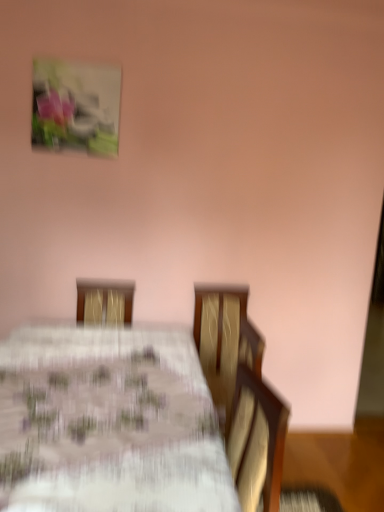
The height and width of the screenshot is (512, 384). What do you see at coordinates (76, 106) in the screenshot?
I see `matte plastic picture frame at upper left` at bounding box center [76, 106].

The image size is (384, 512). I want to click on matte plastic picture frame at upper left, so click(76, 106).

What is the approximate height of matte plastic picture frame at upper left?

20.04 inches.

Find the location of a particular element. Image resolution: width=384 pixels, height=512 pixels. white floral tablecloth at center is located at coordinates (108, 423).

This screenshot has width=384, height=512. Describe the element at coordinates (108, 423) in the screenshot. I see `white floral tablecloth at center` at that location.

You are a GUI agent. You are given a task and a screenshot of the screen. Output one action in this format:
    pyautogui.click(x=<x>, y=<y>)
    Task: Click on the matte plastic picture frame at upper left
    
    Given the screenshot: What is the action you would take?
    pyautogui.click(x=76, y=106)

Considering the relative positions of white floral tablecloth at center and matte plastic picture frame at upper left in the image provided, is white floral tablecloth at center to the left of matte plastic picture frame at upper left from the viewer's perspective?

No, white floral tablecloth at center is not to the left of matte plastic picture frame at upper left.

Does white floral tablecloth at center lie in front of matte plastic picture frame at upper left?

That is True.

Looking at this image, which is further, (x=63, y=374) or (x=119, y=85)?

Positioned behind is point (x=119, y=85).

Looking at this image, from the image's perspective, is white floral tablecloth at center under matte plastic picture frame at upper left?

Correct, white floral tablecloth at center appears lower than matte plastic picture frame at upper left in the image.

From a real-world perspective, who is located lower, white floral tablecloth at center or matte plastic picture frame at upper left?

white floral tablecloth at center.

Is white floral tablecloth at center thinner than matte plastic picture frame at upper left?

No, white floral tablecloth at center is not thinner than matte plastic picture frame at upper left.

Can you confirm if white floral tablecloth at center is taller than matte plastic picture frame at upper left?

Indeed, white floral tablecloth at center has a greater height compared to matte plastic picture frame at upper left.

Considering the sizes of white floral tablecloth at center and matte plastic picture frame at upper left in the image, is white floral tablecloth at center bigger or smaller than matte plastic picture frame at upper left?

In the image, white floral tablecloth at center appears to be larger than matte plastic picture frame at upper left.

Is white floral tablecloth at center inside or outside of matte plastic picture frame at upper left?

white floral tablecloth at center is not enclosed by matte plastic picture frame at upper left.

Is white floral tablecloth at center in contact with matte plastic picture frame at upper left?

white floral tablecloth at center and matte plastic picture frame at upper left are clearly separated.

Is white floral tablecloth at center oriented away from matte plastic picture frame at upper left?

No, white floral tablecloth at center is not facing away from matte plastic picture frame at upper left.

Can you tell me how much white floral tablecloth at center and matte plastic picture frame at upper left differ in facing direction?

The angular difference between white floral tablecloth at center and matte plastic picture frame at upper left is 1.1 degrees.

Where is `picture frame that is above the white floral tablecloth at center (from a real-world perspective)`? The image size is (384, 512). picture frame that is above the white floral tablecloth at center (from a real-world perspective) is located at coordinates (76, 106).

Considering the positions of objects matte plastic picture frame at upper left and white floral tablecloth at center in the image provided, who is more to the left, matte plastic picture frame at upper left or white floral tablecloth at center?

matte plastic picture frame at upper left.

Which object is closer to the camera, matte plastic picture frame at upper left or white floral tablecloth at center?

Positioned in front is white floral tablecloth at center.

Which point is more distant from viewer, (101, 144) or (49, 441)?

The point (101, 144) is farther.

From the image's perspective, is matte plastic picture frame at upper left on top of white floral tablecloth at center?

Yes, from the image's perspective, matte plastic picture frame at upper left is on top of white floral tablecloth at center.

From a real-world perspective, is matte plastic picture frame at upper left positioned under white floral tablecloth at center based on gravity?

No, from a real-world perspective, matte plastic picture frame at upper left is not beneath white floral tablecloth at center.

Is matte plastic picture frame at upper left wider than white floral tablecloth at center?

In fact, matte plastic picture frame at upper left might be narrower than white floral tablecloth at center.

Which of these two, matte plastic picture frame at upper left or white floral tablecloth at center, stands taller?

white floral tablecloth at center is taller.

Can you confirm if matte plastic picture frame at upper left is smaller than white floral tablecloth at center?

Yes.

Consider the image. Is matte plastic picture frame at upper left located outside white floral tablecloth at center?

Yes, matte plastic picture frame at upper left is not within white floral tablecloth at center.

Are matte plastic picture frame at upper left and white floral tablecloth at center far apart?

Yes, matte plastic picture frame at upper left and white floral tablecloth at center are located far from each other.

Does matte plastic picture frame at upper left turn towards white floral tablecloth at center?

No, matte plastic picture frame at upper left is not oriented towards white floral tablecloth at center.

How different are the orientations of matte plastic picture frame at upper left and white floral tablecloth at center in degrees?

They differ by 1.1 degrees in their facing directions.

Where is `picture frame behind the white floral tablecloth at center`? The height and width of the screenshot is (512, 384). picture frame behind the white floral tablecloth at center is located at coordinates (76, 106).

Find the location of a particular element. Image resolution: width=384 pixels, height=512 pixels. picture frame on the left of white floral tablecloth at center is located at coordinates [76, 106].

Identify the location of table located on the right of matte plastic picture frame at upper left. (108, 423).